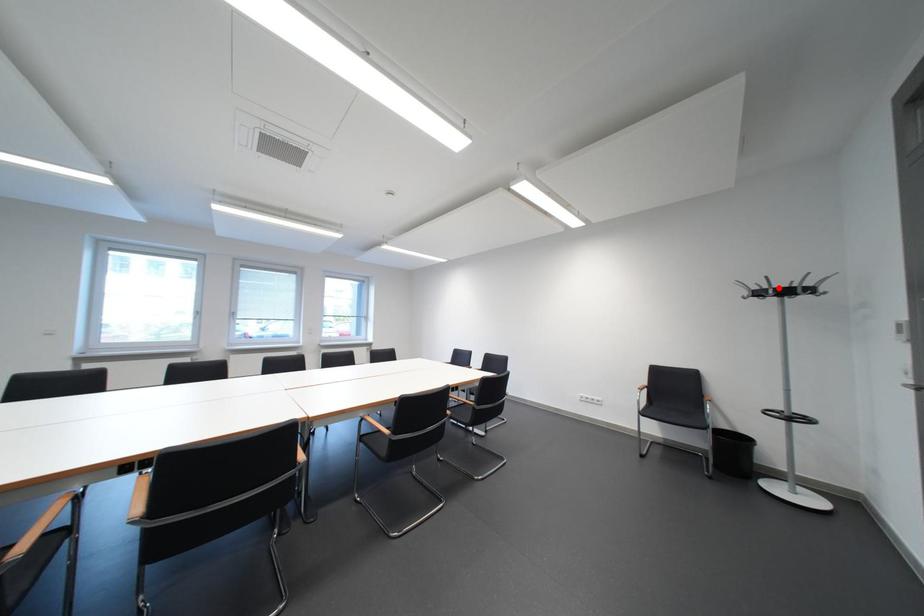
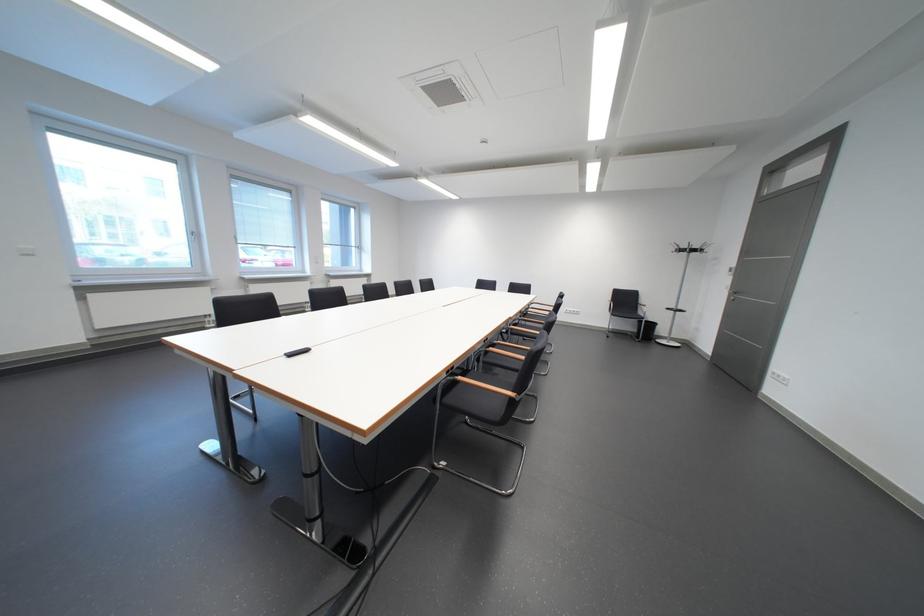
In the second image, find the point that corresponds to the highlighted location in the first image.

(698, 248)